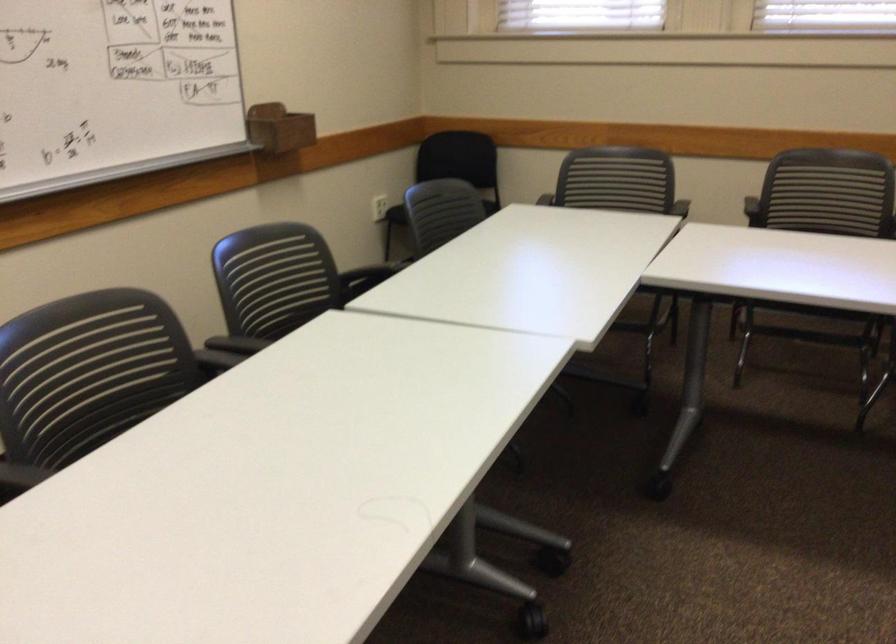
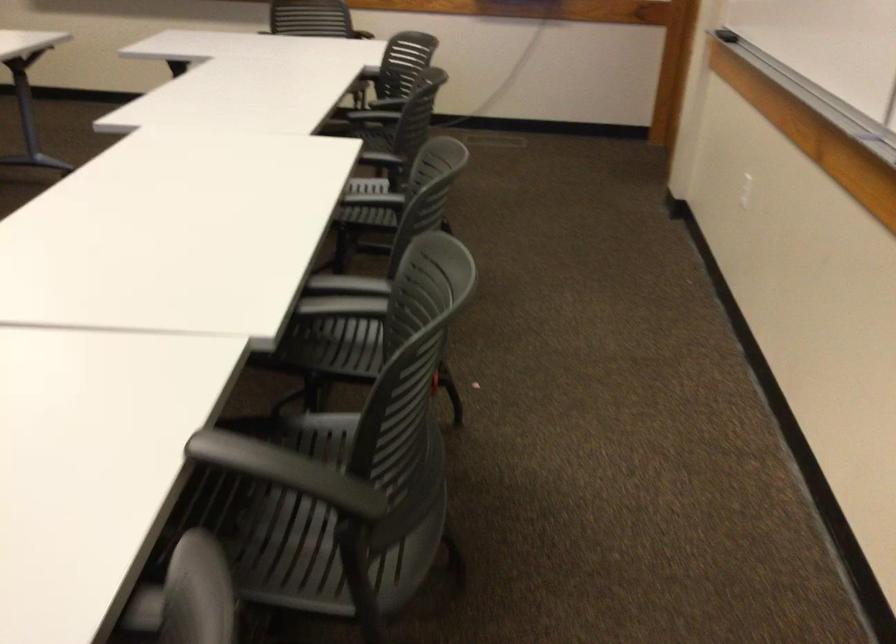
Find the pixel in the second image that matches (x=339, y=277) in the first image.

(286, 471)